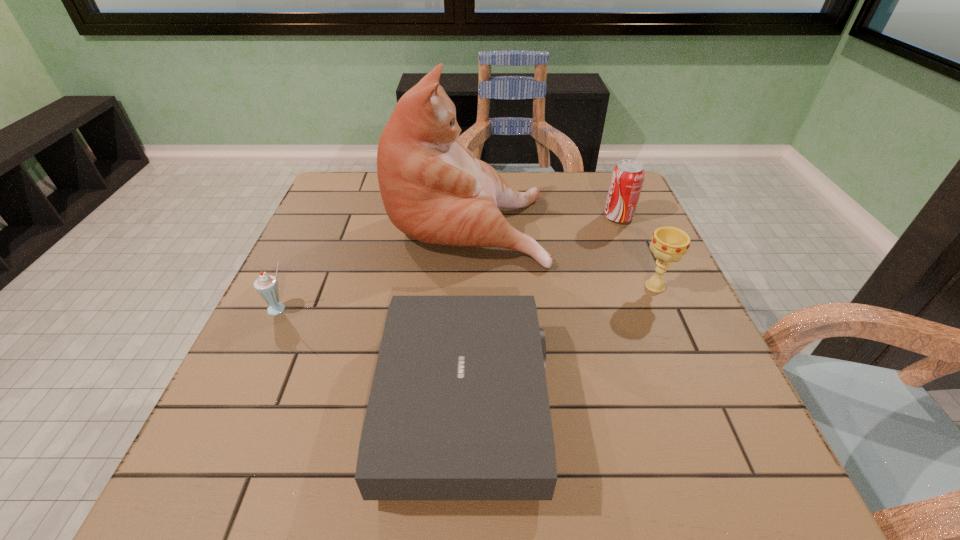
Where is `free region at the far edge of the desktop`? free region at the far edge of the desktop is located at coordinates 557,199.

Locate an element on the screen. free point at the near edge is located at coordinates (667, 508).

The image size is (960, 540). In the image, there is a desktop. Find the location of `free space at the left edge`. free space at the left edge is located at coordinates (337, 237).

Where is `vacant space at the right edge of the desktop`? The image size is (960, 540). vacant space at the right edge of the desktop is located at coordinates (636, 330).

This screenshot has width=960, height=540. Find the location of `vacant space that is in between the third farthest object and the tallest object`. vacant space that is in between the third farthest object and the tallest object is located at coordinates (561, 253).

Find the location of a particular element. The image size is (960, 540). empty location between the soda can and the chalice is located at coordinates (636, 252).

Where is `vacant point located between the milkshake and the cat`? This screenshot has height=540, width=960. vacant point located between the milkshake and the cat is located at coordinates (373, 265).

You are a GUI agent. You are given a task and a screenshot of the screen. Output one action in this format:
    pyautogui.click(x=<x>, y=<y>)
    Task: Click on the unoccupied area between the cat and the milkshake
    Image resolution: width=960 pixels, height=540 pixels.
    Given the screenshot: What is the action you would take?
    pyautogui.click(x=373, y=265)

The width and height of the screenshot is (960, 540). In order to click on empty space between the third farthest object and the soda can in this screenshot , I will do `click(636, 252)`.

This screenshot has width=960, height=540. Find the location of `free space between the projector and the soda can`. free space between the projector and the soda can is located at coordinates (541, 310).